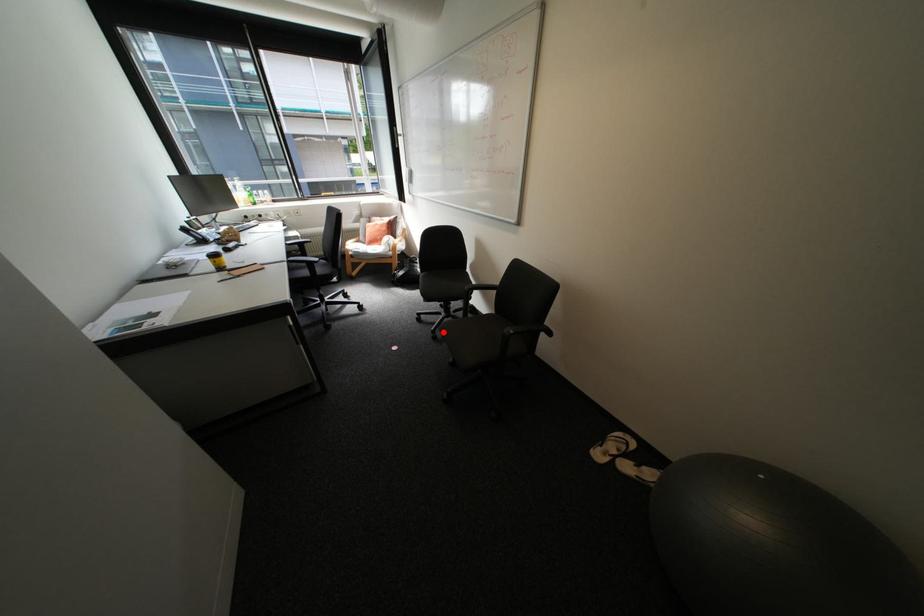
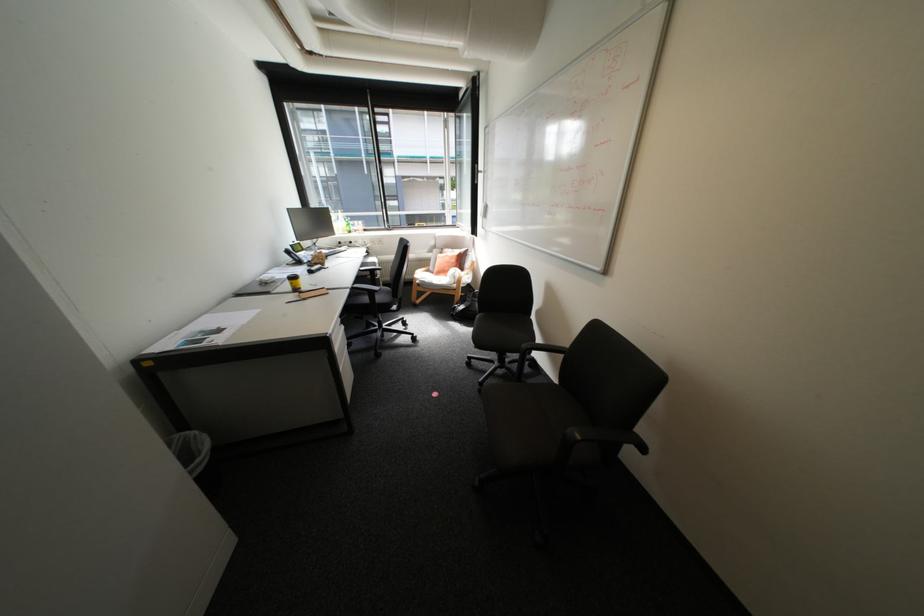
Question: I am providing you with two images of the same scene from different viewpoints. In image1, a red point is highlighted. Considering the same 3D point in image2, which of the following is correct?

Choices:
 (A) It is closer
 (B) It is farther

Answer: (A)